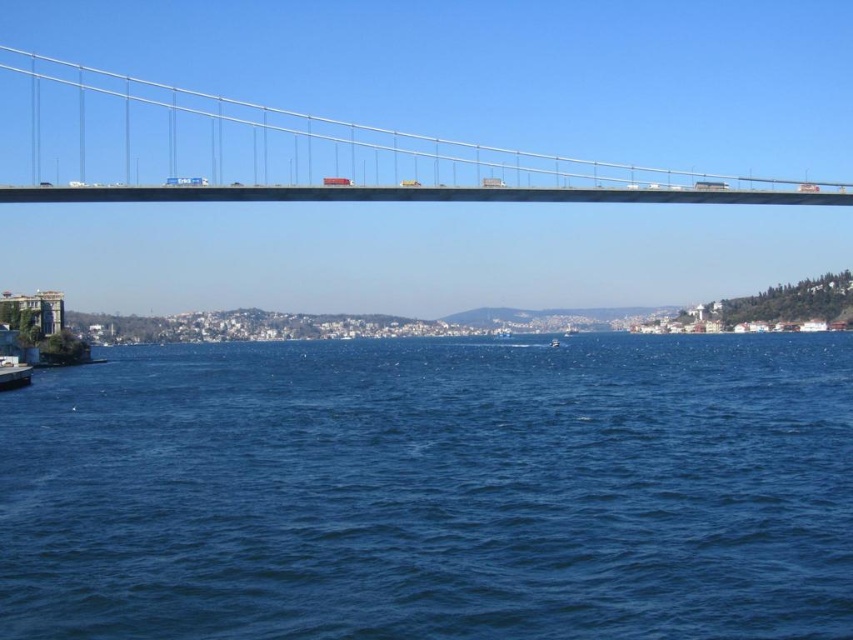
Question: Which of the following is the farthest from the observer?

Choices:
 (A) (73, 140)
 (B) (689, 353)

Answer: (A)

Question: Is blue water at center positioned before metallic gray suspension bridge at upper center?

Choices:
 (A) yes
 (B) no

Answer: (A)

Question: Can you confirm if blue water at center is bigger than metallic gray suspension bridge at upper center?

Choices:
 (A) no
 (B) yes

Answer: (A)

Question: Which object is farther from the camera taking this photo?

Choices:
 (A) blue water at center
 (B) metallic gray suspension bridge at upper center

Answer: (B)

Question: Observing the image, what is the correct spatial positioning of blue water at center in reference to metallic gray suspension bridge at upper center?

Choices:
 (A) below
 (B) above

Answer: (A)